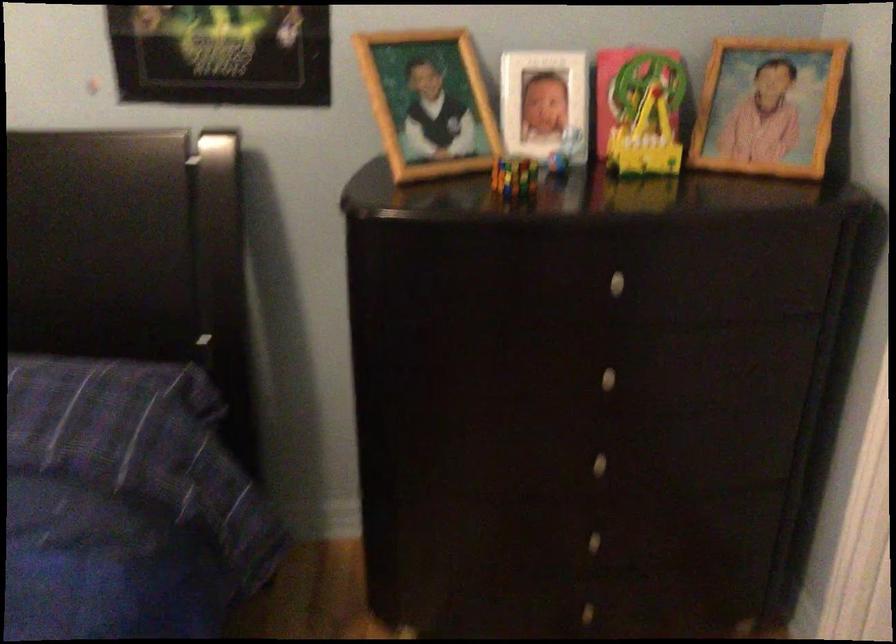
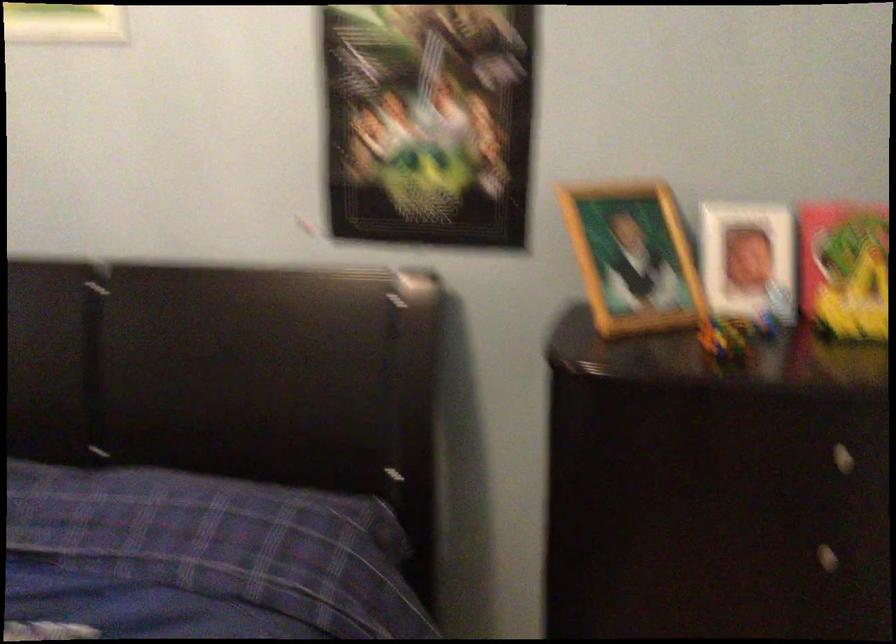
Question: The camera is either moving clockwise (left) or counter-clockwise (right) around the object. The first image is from the beginning of the video and the second image is from the end. Is the camera moving left or right when shooting the video?

Choices:
 (A) Left
 (B) Right

Answer: (B)